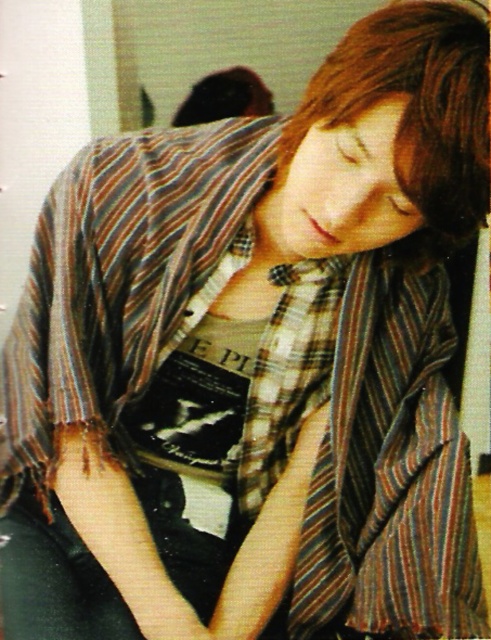
Looking at this image, who is lower down, brown smooth hair at upper center or shiny brown hair at upper center?

brown smooth hair at upper center is below.

At what (x,y) coordinates should I click in order to perform the action: click on brown smooth hair at upper center. Please return your answer as a coordinate pair (x, y). The image size is (491, 640). Looking at the image, I should click on (415, 113).